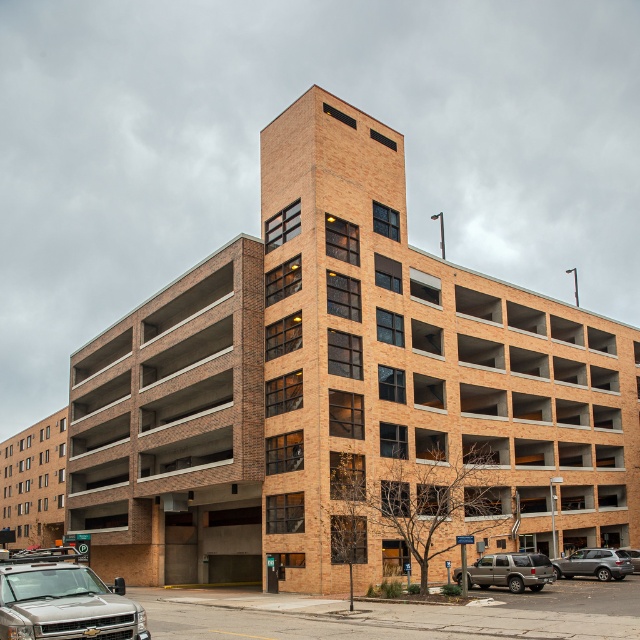
Question: Which of the following is the farthest from the observer?

Choices:
 (A) silver metallic suv at lower left
 (B) metallic silver suv at lower right
 (C) satin silver suv at lower right
 (D) silver metallic suv at lower right

Answer: (C)

Question: Based on their relative distances, which object is nearer to the silver metallic suv at lower left?

Choices:
 (A) satin silver suv at lower right
 (B) silver metallic suv at lower right

Answer: (B)

Question: Is silver metallic suv at lower left smaller than silver metallic suv at lower right?

Choices:
 (A) no
 (B) yes

Answer: (A)

Question: In this image, where is silver metallic suv at lower left located relative to metallic silver suv at lower right?

Choices:
 (A) right
 (B) left

Answer: (B)

Question: Which object is positioned farthest from the silver metallic suv at lower right?

Choices:
 (A) silver metallic suv at lower left
 (B) satin silver suv at lower right

Answer: (A)

Question: From the image, what is the correct spatial relationship of silver metallic suv at lower left in relation to satin silver suv at lower right?

Choices:
 (A) right
 (B) left

Answer: (B)